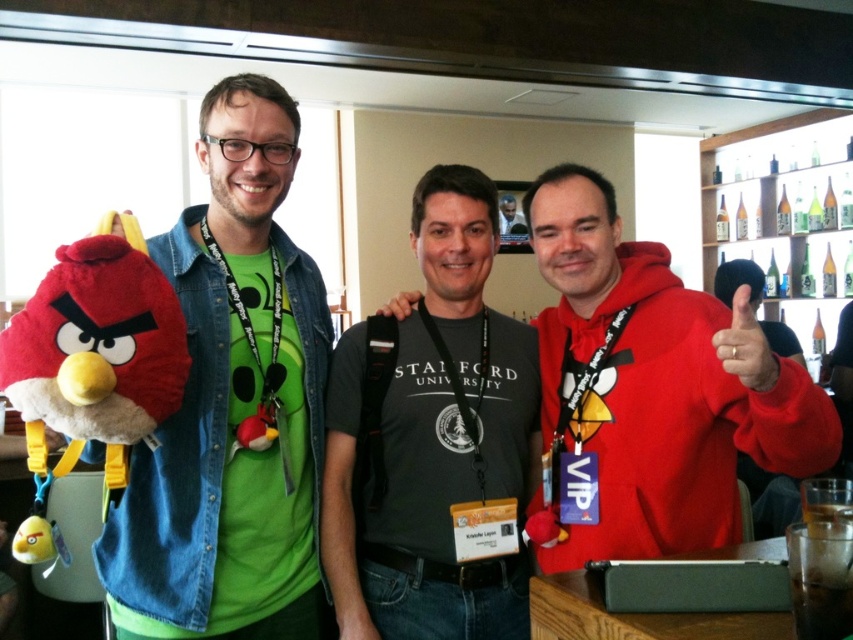
Between dark gray t-shirt at center and matte red hoodie at center, which one appears on the left side from the viewer's perspective?

From the viewer's perspective, dark gray t-shirt at center appears more on the left side.

Between point (387, 465) and point (723, 518), which one is positioned in front?

Positioned in front is point (723, 518).

This screenshot has width=853, height=640. In order to click on dark gray t-shirt at center in this screenshot , I will do point(433,440).

Which is behind, point (416, 612) or point (26, 307)?

The point (416, 612) is behind.

Who is shorter, dark gray t-shirt at center or soft plush toy at left?

soft plush toy at left

At what (x,y) coordinates should I click in order to perform the action: click on dark gray t-shirt at center. Please return your answer as a coordinate pair (x, y). Looking at the image, I should click on (433, 440).

Who is positioned more to the right, matte plush toy at left or soft plush toy at left?

From the viewer's perspective, matte plush toy at left appears more on the right side.

Which is more to the left, matte plush toy at left or soft plush toy at left?

Positioned to the left is soft plush toy at left.

Identify the location of matte plush toy at left. This screenshot has height=640, width=853. (231, 404).